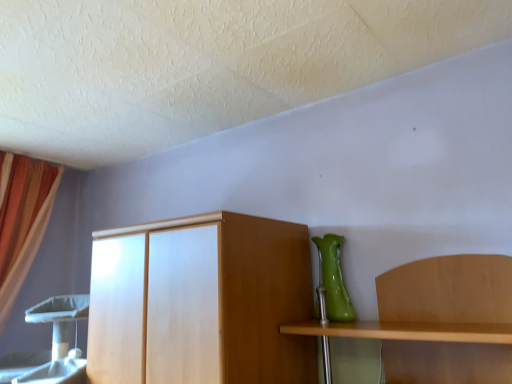
Question: Does point (14, 256) appear closer or farther from the camera than point (330, 284)?

Choices:
 (A) farther
 (B) closer

Answer: (A)

Question: Would you say orange fabric curtain at left is to the left or to the right of green glossy vase at right in the picture?

Choices:
 (A) right
 (B) left

Answer: (B)

Question: Is orange fabric curtain at left taller or shorter than green glossy vase at right?

Choices:
 (A) tall
 (B) short

Answer: (A)

Question: Considering the positions of point (327, 281) and point (27, 231), is point (327, 281) closer or farther from the camera than point (27, 231)?

Choices:
 (A) farther
 (B) closer

Answer: (B)

Question: From a real-world perspective, is green glossy vase at right above or below orange fabric curtain at left?

Choices:
 (A) below
 (B) above

Answer: (A)

Question: From the image's perspective, is green glossy vase at right above or below orange fabric curtain at left?

Choices:
 (A) above
 (B) below

Answer: (A)

Question: In terms of height, does green glossy vase at right look taller or shorter compared to orange fabric curtain at left?

Choices:
 (A) tall
 (B) short

Answer: (B)